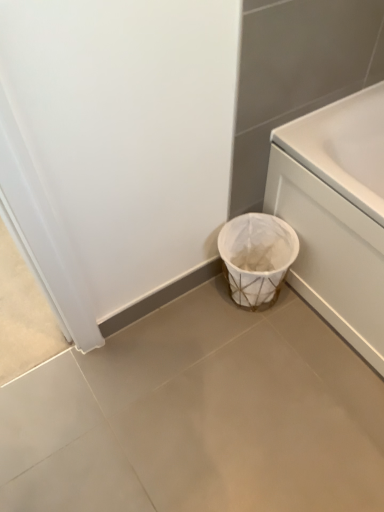
Question: From a real-world perspective, is white woven basket at lower center physically located above or below white matte trash can at lower right?

Choices:
 (A) above
 (B) below

Answer: (A)

Question: Is white woven basket at lower center in front of or behind white matte trash can at lower right in the image?

Choices:
 (A) front
 (B) behind

Answer: (B)

Question: Estimate the real-world distances between objects in this image. Which object is closer to the white matte trash can at lower right?

Choices:
 (A) white woven basket at lower center
 (B) white glossy bathtub at right

Answer: (A)

Question: Which is farther from the white glossy bathtub at right?

Choices:
 (A) white matte trash can at lower right
 (B) white woven basket at lower center

Answer: (A)